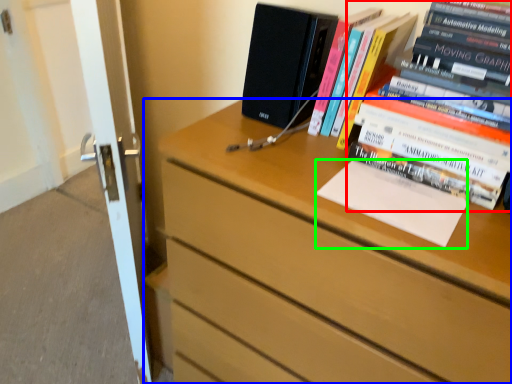
Question: Considering the real-world distances, which object is farthest from book (highlighted by a red box)? chest of drawers (highlighted by a blue box) or paperback book (highlighted by a green box)?

Choices:
 (A) chest of drawers
 (B) paperback book

Answer: (A)